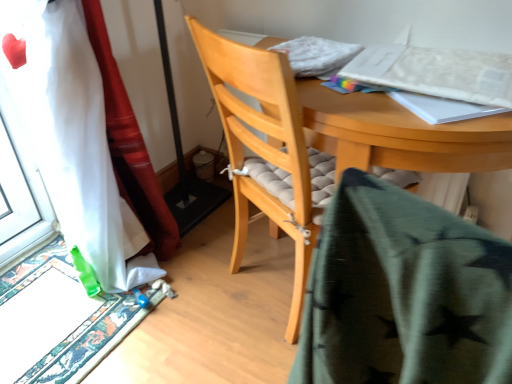
What do you see at coordinates (437, 72) in the screenshot?
I see `white paper at upper right` at bounding box center [437, 72].

Describe the element at coordinates (267, 150) in the screenshot. I see `light wood chair at center` at that location.

Image resolution: width=512 pixels, height=384 pixels. I want to click on white paper at upper right, so click(437, 72).

Is light wood chair at center with carpeted doormat at lower left?

No, light wood chair at center is not with carpeted doormat at lower left.

Looking at this image, from the image's perspective, is light wood chair at center located beneath carpeted doormat at lower left?

Actually, light wood chair at center appears above carpeted doormat at lower left in the image.

Based on the photo, is light wood chair at center turned away from carpeted doormat at lower left?

No, carpeted doormat at lower left is not at the back of light wood chair at center.

Is point (74, 56) farther from viewer compared to point (428, 56)?

That is True.

In the scene shown: Is white paper at upper right inside white sheer curtain at left?

Definitely not — white paper at upper right is not inside white sheer curtain at left.

Does white sheer curtain at left touch white paper at upper right?

No, white sheer curtain at left is not in contact with white paper at upper right.

At what (x,y) coordinates should I click in order to perform the action: click on curtain below the white paper at upper right (from a real-world perspective). Please return your answer as a coordinate pair (x, y). Looking at the image, I should click on (85, 138).

From a real-world perspective, between green star-patterned fabric at center and white sheer curtain at left, who is vertically higher?

green star-patterned fabric at center is physically above.

Is green star-patterned fabric at center oriented away from white sheer curtain at left?

green star-patterned fabric at center does not have its back to white sheer curtain at left.

From the image's perspective, which is below, green star-patterned fabric at center or white sheer curtain at left?

green star-patterned fabric at center is shown below in the image.

Is point (416, 87) positioned in front of point (245, 89)?

Yes, it is.

From the picture: From a real-world perspective, is white paper at upper right above or below light wood chair at center?

white paper at upper right is situated higher than light wood chair at center in the real world.

From the image's perspective, which is above, white paper at upper right or light wood chair at center?

white paper at upper right.

In the scene shown: Could you tell me if white paper at upper right is turned towards green star-patterned fabric at center?

Yes, white paper at upper right is facing green star-patterned fabric at center.

Can you confirm if white paper at upper right is taller than green star-patterned fabric at center?

In fact, white paper at upper right may be shorter than green star-patterned fabric at center.

Between white paper at upper right and green star-patterned fabric at center, which one appears on the left side from the viewer's perspective?

green star-patterned fabric at center.

How much distance is there between white paper at upper right and green star-patterned fabric at center?

22.65 inches.

Is white paper at upper right oriented away from carpeted doormat at lower left?

No, carpeted doormat at lower left is not at the back of white paper at upper right.

Are white paper at upper right and carpeted doormat at lower left making contact?

No, white paper at upper right is not with carpeted doormat at lower left.

Can you tell me how much white paper at upper right and carpeted doormat at lower left differ in facing direction?

There is a 86.7-degree angle between the facing directions of white paper at upper right and carpeted doormat at lower left.

From the picture: From a real-world perspective, who is located higher, white paper at upper right or carpeted doormat at lower left?

white paper at upper right, from a real-world perspective.

Is white sheer curtain at left inside white paper at upper right?

Definitely not — white sheer curtain at left is not inside white paper at upper right.

Could you tell me if white paper at upper right is turned towards white sheer curtain at left?

No, white paper at upper right is not facing towards white sheer curtain at left.

This screenshot has width=512, height=384. Find the location of `chair lying on the right of carpeted doormat at lower left`. chair lying on the right of carpeted doormat at lower left is located at coordinates (267, 150).

Find the location of `paperback book above the white sheer curtain at left (from the image's perspective)`. paperback book above the white sheer curtain at left (from the image's perspective) is located at coordinates (437, 72).

When comparing their distances from carpeted doormat at lower left, does white sheer curtain at left or white paper at upper right seem further?

The object further to carpeted doormat at lower left is white paper at upper right.

Considering their positions, is light wood chair at center positioned further to green star-patterned fabric at center than white paper at upper right?

white paper at upper right is further to green star-patterned fabric at center.

Based on their spatial positions, is white paper at upper right or green star-patterned fabric at center further from white sheer curtain at left?

Among the two, green star-patterned fabric at center is located further to white sheer curtain at left.

When comparing their distances from green star-patterned fabric at center, does light wood chair at center or white sheer curtain at left seem closer?

light wood chair at center.

Estimate the real-world distances between objects in this image. Which object is further from white paper at upper right, light wood chair at center or carpeted doormat at lower left?

carpeted doormat at lower left lies further to white paper at upper right than the other object.

Looking at the image, which one is located further to green star-patterned fabric at center, carpeted doormat at lower left or white paper at upper right?

carpeted doormat at lower left lies further to green star-patterned fabric at center than the other object.

Considering their positions, is white sheer curtain at left positioned closer to green star-patterned fabric at center than light wood chair at center?

light wood chair at center lies closer to green star-patterned fabric at center than the other object.

Considering their positions, is green star-patterned fabric at center positioned closer to white sheer curtain at left than carpeted doormat at lower left?

Among the two, carpeted doormat at lower left is located nearer to white sheer curtain at left.

You are a GUI agent. You are given a task and a screenshot of the screen. Output one action in this format:
    pyautogui.click(x=<x>, y=<y>)
    Task: Click on the chair between white sheer curtain at left and white paper at upper right
    This screenshot has width=512, height=384.
    Given the screenshot: What is the action you would take?
    pyautogui.click(x=267, y=150)

You are a GUI agent. You are given a task and a screenshot of the screen. Output one action in this format:
    pyautogui.click(x=<x>, y=<y>)
    Task: Click on the blanket between white sheer curtain at left and white paper at upper right
    This screenshot has width=512, height=384.
    Given the screenshot: What is the action you would take?
    pyautogui.click(x=404, y=294)

The image size is (512, 384). Find the location of `chair situated between white sheer curtain at left and green star-patterned fabric at center from left to right`. chair situated between white sheer curtain at left and green star-patterned fabric at center from left to right is located at coordinates (267, 150).

At what (x,y) coordinates should I click in order to perform the action: click on curtain between carpeted doormat at lower left and white paper at upper right from left to right. Please return your answer as a coordinate pair (x, y). Looking at the image, I should click on (85, 138).